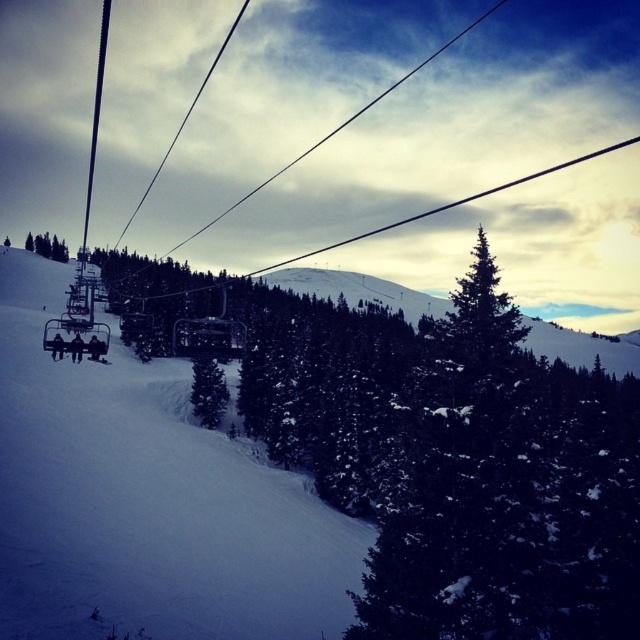
You are standing at the point marked as point (209,392) in the image. What object is exactly at this location?

The green matte tree at center is located at point (209,392).